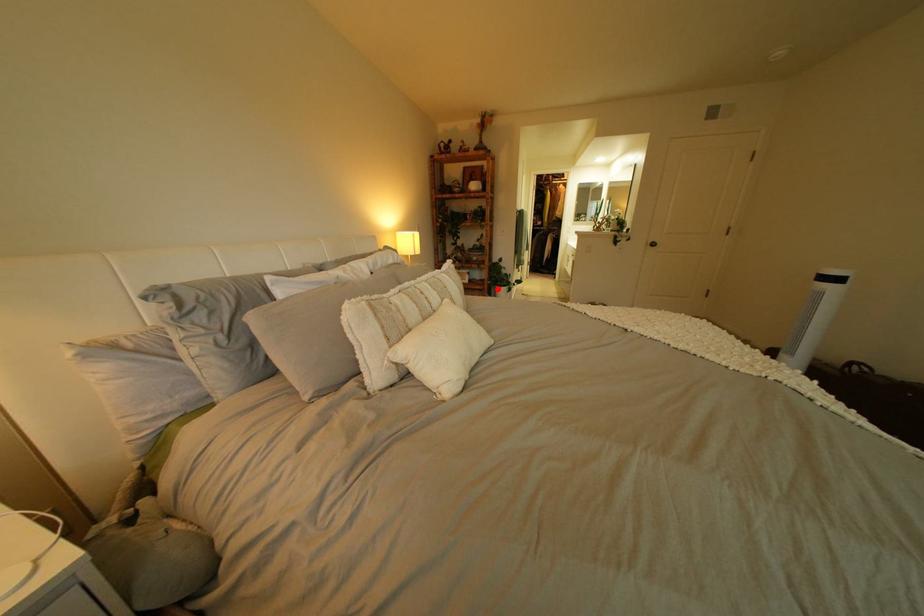
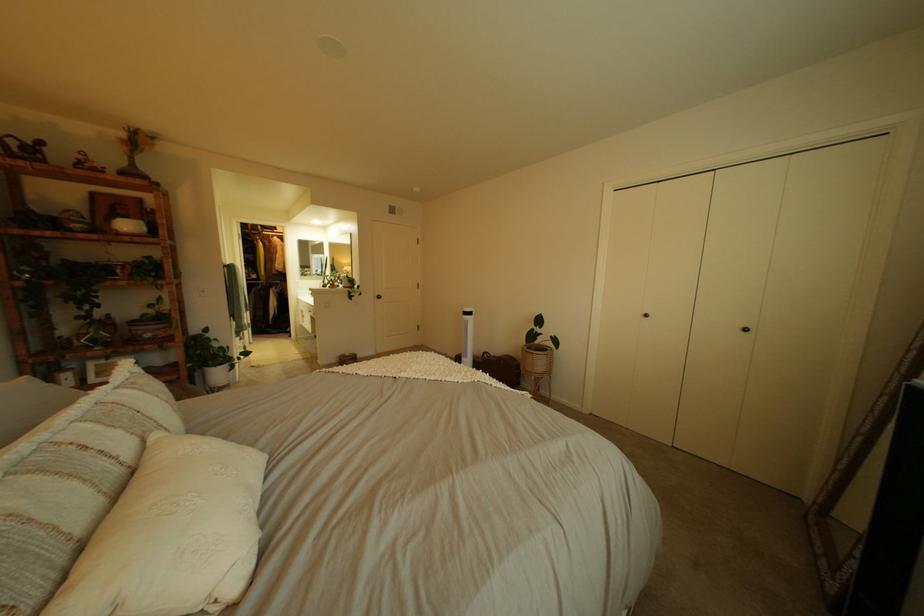
Find the pixel in the second image that matches the highlighted location in the first image.

(189, 379)